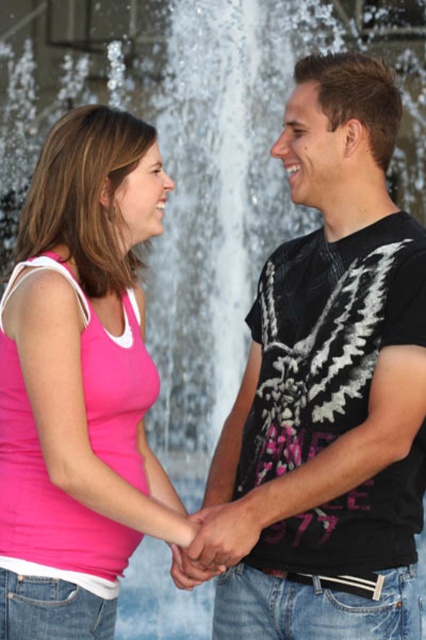
You are standing at the camera position and want to reach the point marked as point (236, 572). If your walking speed is 3 feet per second, how many seconds will it take you to reach that point?

The point (236, 572) is 20.81 feet away from the camera. At a speed of 3 feet per second, it would take approximately 6.94 seconds to reach the point.